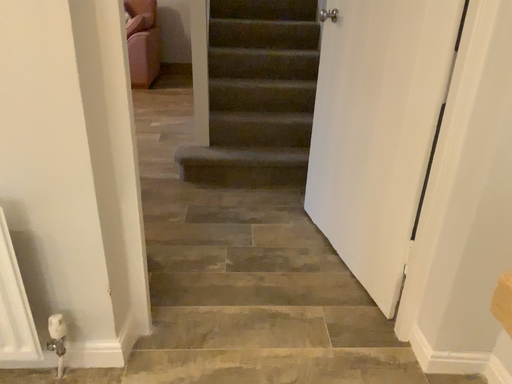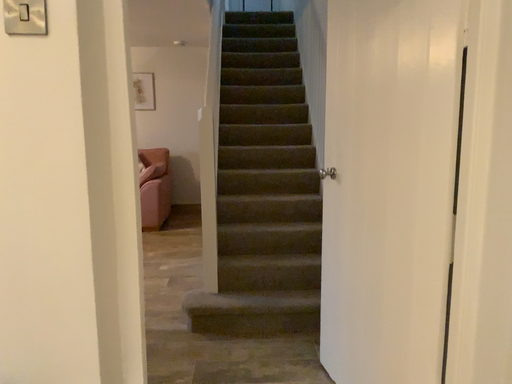
Question: Which way did the camera rotate in the video?

Choices:
 (A) rotated upward
 (B) rotated downward

Answer: (A)